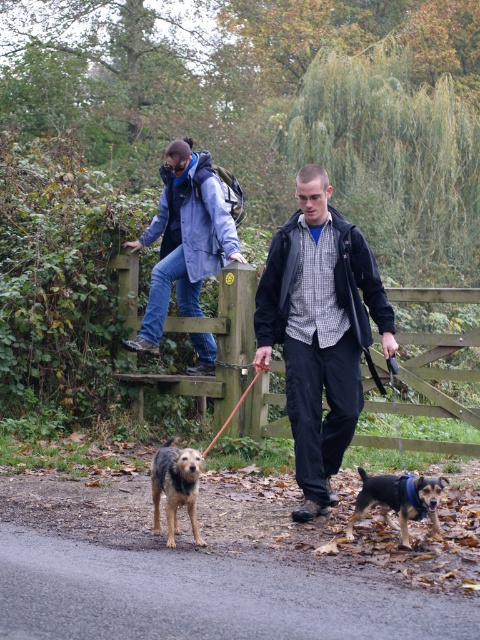
Question: Can you confirm if brown dirt path at lower center is thinner than blue denim jacket at upper center?

Choices:
 (A) yes
 (B) no

Answer: (B)

Question: Can you confirm if brown dirt path at lower center is positioned to the left of matte black jacket at center?

Choices:
 (A) yes
 (B) no

Answer: (A)

Question: Which point is farther to the camera?

Choices:
 (A) matte black jacket at center
 (B) red nylon leash at center

Answer: (B)

Question: Which point is closer to the camera taking this photo?

Choices:
 (A) click(x=169, y=461)
 (B) click(x=368, y=337)
 (C) click(x=201, y=358)

Answer: (A)

Question: Which point is closer to the camera?

Choices:
 (A) (348, 394)
 (B) (195, 534)

Answer: (B)

Question: Can you confirm if blue denim jacket at upper center is thinner than brown fur dog at lower center?

Choices:
 (A) no
 (B) yes

Answer: (A)